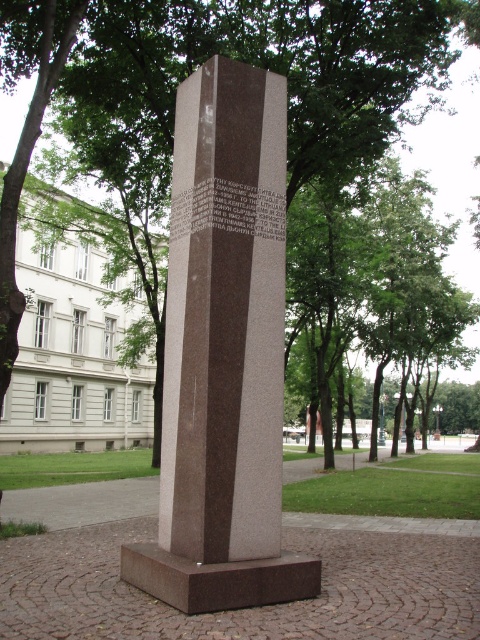
Can you confirm if brown polished stone monument at center is positioned to the left of green leafy tree at center?

Indeed, brown polished stone monument at center is positioned on the left side of green leafy tree at center.

Is point (172, 428) positioned in front of point (119, 28)?

Yes, point (172, 428) is in front of point (119, 28).

This screenshot has height=640, width=480. In order to click on brown polished stone monument at center in this screenshot , I will do `click(224, 355)`.

Where is `brown polished stone monument at center`? brown polished stone monument at center is located at coordinates (224, 355).